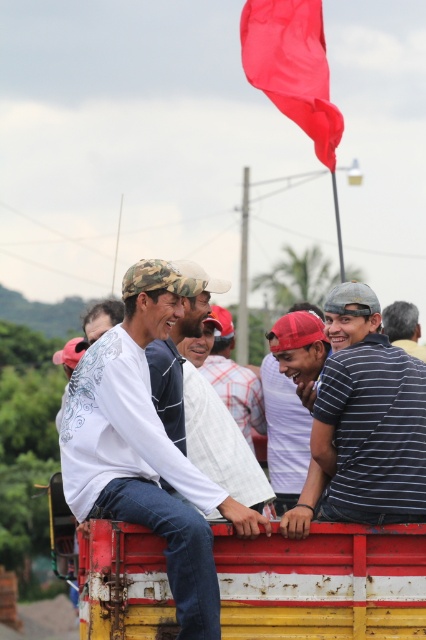
You are a photographer taking a picture of the striped cotton shirt at center and the gray striped shirt at upper right. Which shirt should you focus on first if you want to capture both shirts in the frame without moving the camera?

You should focus on the striped cotton shirt at center first because it is shorter than the gray striped shirt at upper right, allowing you to frame both shirts effectively by adjusting the camera angle to include both heights.

You are a photographer standing at the back of the truck. You want to take a photo of both the striped cotton shirt at center and the white cotton shirt at center. Can you fit both shirts in your camera frame if your camera has a maximum horizontal field of view of 10 meters?

The distance between the striped cotton shirt at center and the white cotton shirt at center is 8.82 meters. Since your camera has a maximum horizontal field of view of 10 meters, which is wider than the distance between them, both shirts can fit within the frame.